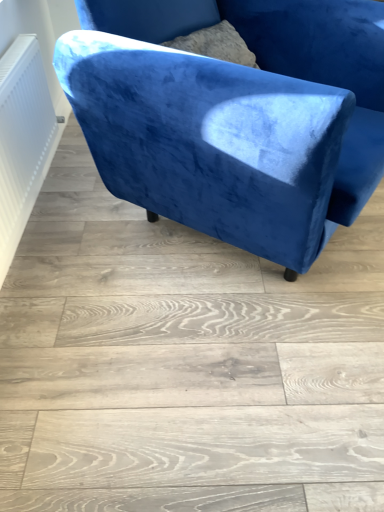
Question: Is white textured radiator at left bigger than velvet blue armchair at upper center?

Choices:
 (A) yes
 (B) no

Answer: (B)

Question: Can we say white textured radiator at left lies outside velvet blue armchair at upper center?

Choices:
 (A) yes
 (B) no

Answer: (A)

Question: Considering the relative sizes of white textured radiator at left and velvet blue armchair at upper center in the image provided, is white textured radiator at left smaller than velvet blue armchair at upper center?

Choices:
 (A) no
 (B) yes

Answer: (B)

Question: Does white textured radiator at left appear on the right side of velvet blue armchair at upper center?

Choices:
 (A) no
 (B) yes

Answer: (A)

Question: Considering the relative sizes of white textured radiator at left and velvet blue armchair at upper center in the image provided, is white textured radiator at left taller than velvet blue armchair at upper center?

Choices:
 (A) no
 (B) yes

Answer: (A)

Question: Does white textured radiator at left have a greater width compared to velvet blue armchair at upper center?

Choices:
 (A) yes
 (B) no

Answer: (B)

Question: From a real-world perspective, does velvet blue armchair at upper center stand above white textured radiator at left?

Choices:
 (A) no
 (B) yes

Answer: (B)

Question: Considering the relative sizes of velvet blue armchair at upper center and white textured radiator at left in the image provided, is velvet blue armchair at upper center bigger than white textured radiator at left?

Choices:
 (A) no
 (B) yes

Answer: (B)

Question: Does velvet blue armchair at upper center have a greater width compared to white textured radiator at left?

Choices:
 (A) no
 (B) yes

Answer: (B)

Question: Considering the relative sizes of velvet blue armchair at upper center and white textured radiator at left in the image provided, is velvet blue armchair at upper center taller than white textured radiator at left?

Choices:
 (A) no
 (B) yes

Answer: (B)

Question: Would you say white textured radiator at left is part of velvet blue armchair at upper center's contents?

Choices:
 (A) yes
 (B) no

Answer: (B)

Question: Considering the relative positions of velvet blue armchair at upper center and white textured radiator at left in the image provided, is velvet blue armchair at upper center in front of white textured radiator at left?

Choices:
 (A) yes
 (B) no

Answer: (A)

Question: Choose the correct answer: Is velvet blue armchair at upper center inside white textured radiator at left or outside it?

Choices:
 (A) inside
 (B) outside

Answer: (B)